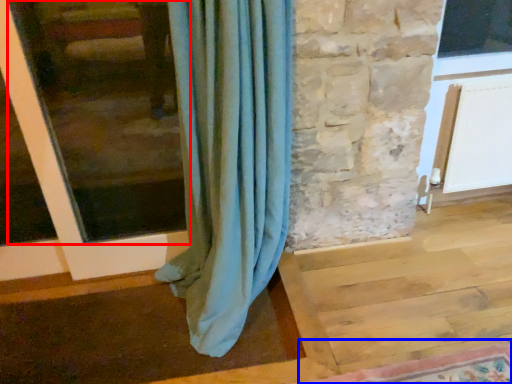
Question: Which of the following is the closest to the observer, window frame (highlighted by a red box) or mat (highlighted by a blue box)?

Choices:
 (A) window frame
 (B) mat

Answer: (B)